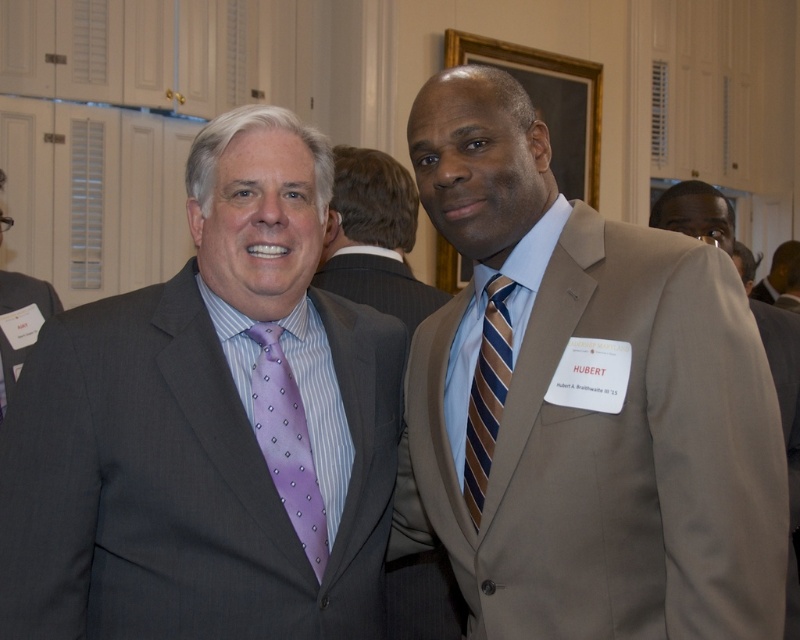
How much distance is there between brown striped tie at center and matte black face at upper right?

3.37 feet

Does brown striped tie at center have a greater height compared to matte black face at upper right?

Yes.

This screenshot has width=800, height=640. Describe the element at coordinates (488, 394) in the screenshot. I see `brown striped tie at center` at that location.

The width and height of the screenshot is (800, 640). What are the coordinates of `brown striped tie at center` in the screenshot? It's located at (488, 394).

Between point (664, 531) and point (486, 419), which one is positioned behind?

The point (486, 419) is more distant.

Is point (724, 276) less distant than point (504, 278)?

Yes, point (724, 276) is closer to viewer.

Which is behind, point (490, 282) or point (494, 360)?

Point (490, 282)

You are a GUI agent. You are given a task and a screenshot of the screen. Output one action in this format:
    pyautogui.click(x=<x>, y=<y>)
    Task: Click on the matte beige suit at center
    
    Given the screenshot: What is the action you would take?
    pyautogui.click(x=582, y=406)

Is matte gray suit at left taller than light brown suit at center?

Correct, matte gray suit at left is much taller as light brown suit at center.

Image resolution: width=800 pixels, height=640 pixels. What do you see at coordinates (210, 428) in the screenshot?
I see `matte gray suit at left` at bounding box center [210, 428].

The image size is (800, 640). What do you see at coordinates (210, 428) in the screenshot?
I see `matte gray suit at left` at bounding box center [210, 428].

Where is `matte gray suit at left`? Image resolution: width=800 pixels, height=640 pixels. matte gray suit at left is located at coordinates (210, 428).